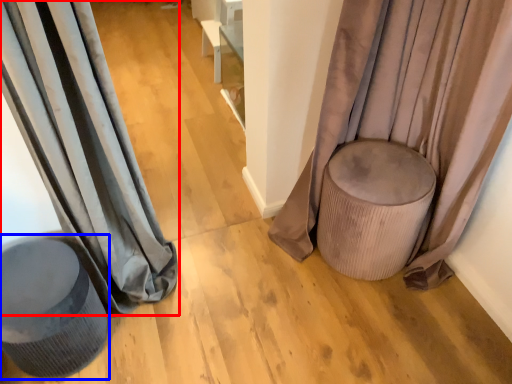
Question: Which object is closer to the camera taking this photo, curtain (highlighted by a red box) or swivel chair (highlighted by a blue box)?

Choices:
 (A) curtain
 (B) swivel chair

Answer: (A)